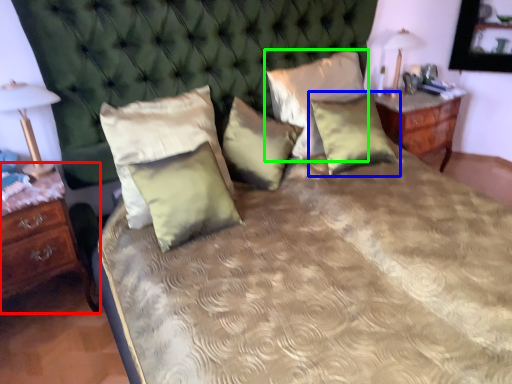
Question: Considering the real-world distances, which object is farthest from nightstand (highlighted by a red box)? pillow (highlighted by a blue box) or pillow (highlighted by a green box)?

Choices:
 (A) pillow
 (B) pillow

Answer: (A)